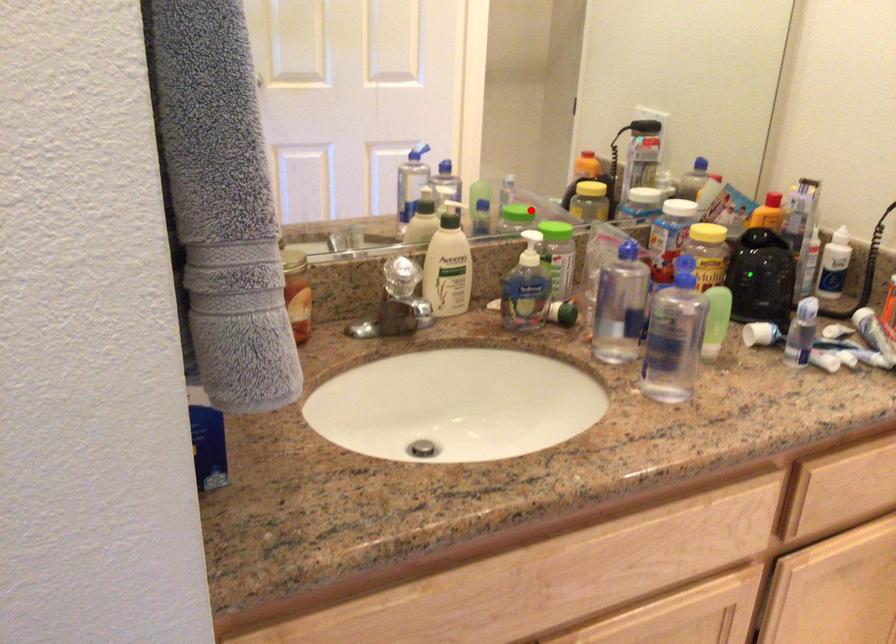
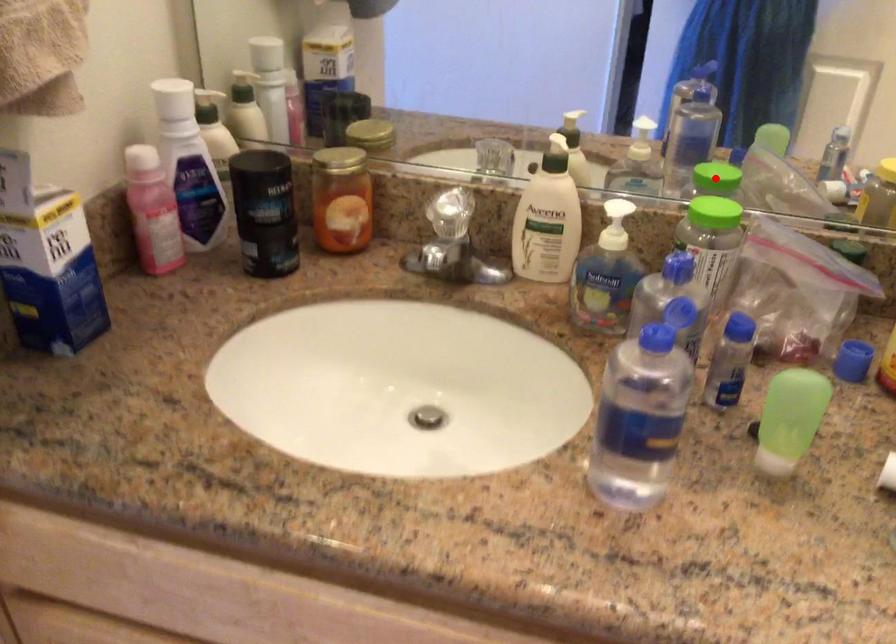
I am providing you with two images of the same scene from different viewpoints. A red point is marked on the first image and another point is marked on the second image. Are the points marked in image1 and image2 representing the same 3D position?

Yes